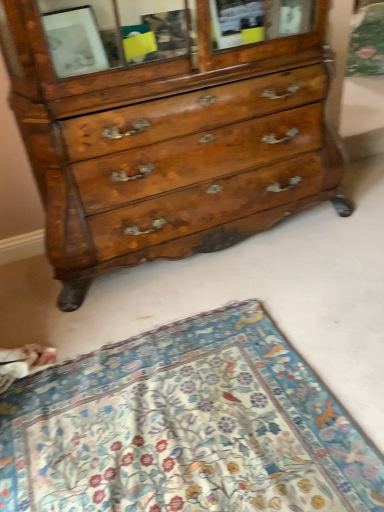
What do you see at coordinates (185, 426) in the screenshot?
I see `floral-patterned fabric at lower center` at bounding box center [185, 426].

Image resolution: width=384 pixels, height=512 pixels. Find the location of `floral-patterned fabric at lower center`. floral-patterned fabric at lower center is located at coordinates (185, 426).

This screenshot has width=384, height=512. Describe the element at coordinates (173, 133) in the screenshot. I see `shiny brown wood chest of drawers at center` at that location.

Image resolution: width=384 pixels, height=512 pixels. I want to click on shiny brown wood chest of drawers at center, so pyautogui.click(x=173, y=133).

Where is `floral-patterned fabric at lower center`? Image resolution: width=384 pixels, height=512 pixels. floral-patterned fabric at lower center is located at coordinates (185, 426).

Is floral-patterned fabric at lower center at the right side of shiny brown wood chest of drawers at center?

No, floral-patterned fabric at lower center is not to the right of shiny brown wood chest of drawers at center.

In the image, is floral-patterned fabric at lower center positioned in front of or behind shiny brown wood chest of drawers at center?

floral-patterned fabric at lower center is positioned closer to the viewer than shiny brown wood chest of drawers at center.

Considering the points (208, 320) and (117, 140), which point is behind, point (208, 320) or point (117, 140)?

The point (208, 320) is behind.

From the image's perspective, is floral-patterned fabric at lower center under shiny brown wood chest of drawers at center?

Indeed, from the image's perspective, floral-patterned fabric at lower center is shown beneath shiny brown wood chest of drawers at center.

From a real-world perspective, is floral-patterned fabric at lower center located higher than shiny brown wood chest of drawers at center?

No, from a real-world perspective, floral-patterned fabric at lower center is not on top of shiny brown wood chest of drawers at center.

Is floral-patterned fabric at lower center wider or thinner than shiny brown wood chest of drawers at center?

Considering their sizes, floral-patterned fabric at lower center looks broader than shiny brown wood chest of drawers at center.

Does floral-patterned fabric at lower center have a lesser height compared to shiny brown wood chest of drawers at center?

Indeed, floral-patterned fabric at lower center has a lesser height compared to shiny brown wood chest of drawers at center.

Is floral-patterned fabric at lower center smaller than shiny brown wood chest of drawers at center?

Correct, floral-patterned fabric at lower center occupies less space than shiny brown wood chest of drawers at center.

Is floral-patterned fabric at lower center positioned beyond the bounds of shiny brown wood chest of drawers at center?

Indeed, floral-patterned fabric at lower center is completely outside shiny brown wood chest of drawers at center.

Are floral-patterned fabric at lower center and shiny brown wood chest of drawers at center located far from each other?

No, floral-patterned fabric at lower center is not far away from shiny brown wood chest of drawers at center.

Could you tell me if floral-patterned fabric at lower center is facing shiny brown wood chest of drawers at center?

No, floral-patterned fabric at lower center does not turn towards shiny brown wood chest of drawers at center.

How different are the orientations of floral-patterned fabric at lower center and shiny brown wood chest of drawers at center in degrees?

91.7 degrees.

Image resolution: width=384 pixels, height=512 pixels. What are the coordinates of `the chest of drawers that appears behind the floral-patterned fabric at lower center` in the screenshot? It's located at (173, 133).

Which object is positioned more to the left, shiny brown wood chest of drawers at center or floral-patterned fabric at lower center?

floral-patterned fabric at lower center.

Considering the positions of objects shiny brown wood chest of drawers at center and floral-patterned fabric at lower center in the image provided, who is in front, shiny brown wood chest of drawers at center or floral-patterned fabric at lower center?

floral-patterned fabric at lower center is closer to the camera.

Considering the points (201, 224) and (136, 456), which point is behind, point (201, 224) or point (136, 456)?

Positioned behind is point (201, 224).

From the image's perspective, is shiny brown wood chest of drawers at center above or below floral-patterned fabric at lower center?

shiny brown wood chest of drawers at center is situated higher than floral-patterned fabric at lower center in the image.

From a real-world perspective, is shiny brown wood chest of drawers at center positioned over floral-patterned fabric at lower center based on gravity?

Yes.

Can you confirm if shiny brown wood chest of drawers at center is thinner than floral-patterned fabric at lower center?

Indeed, shiny brown wood chest of drawers at center has a lesser width compared to floral-patterned fabric at lower center.

Can you confirm if shiny brown wood chest of drawers at center is taller than floral-patterned fabric at lower center?

Correct, shiny brown wood chest of drawers at center is much taller as floral-patterned fabric at lower center.

Between shiny brown wood chest of drawers at center and floral-patterned fabric at lower center, which one has smaller size?

With smaller size is floral-patterned fabric at lower center.

Would you say floral-patterned fabric at lower center is part of shiny brown wood chest of drawers at center's contents?

No, shiny brown wood chest of drawers at center does not contain floral-patterned fabric at lower center.

Is shiny brown wood chest of drawers at center positioned far away from floral-patterned fabric at lower center?

Actually, shiny brown wood chest of drawers at center and floral-patterned fabric at lower center are a little close together.

Is shiny brown wood chest of drawers at center positioned with its back to floral-patterned fabric at lower center?

No, floral-patterned fabric at lower center is not at the back of shiny brown wood chest of drawers at center.

How different are the orientations of shiny brown wood chest of drawers at center and floral-patterned fabric at lower center in degrees?

The angular difference between shiny brown wood chest of drawers at center and floral-patterned fabric at lower center is 91.7 degrees.

Locate an element on the screen. This screenshot has height=512, width=384. chest of drawers on the right of floral-patterned fabric at lower center is located at coordinates (173, 133).

You are a GUI agent. You are given a task and a screenshot of the screen. Output one action in this format:
    pyautogui.click(x=<x>, y=<y>)
    Task: Click on the mat below the shiny brown wood chest of drawers at center (from the image's perspective)
    
    Given the screenshot: What is the action you would take?
    pyautogui.click(x=185, y=426)

At what (x,y) coordinates should I click in order to perform the action: click on mat beneath the shiny brown wood chest of drawers at center (from a real-world perspective). Please return your answer as a coordinate pair (x, y). The height and width of the screenshot is (512, 384). Looking at the image, I should click on (185, 426).